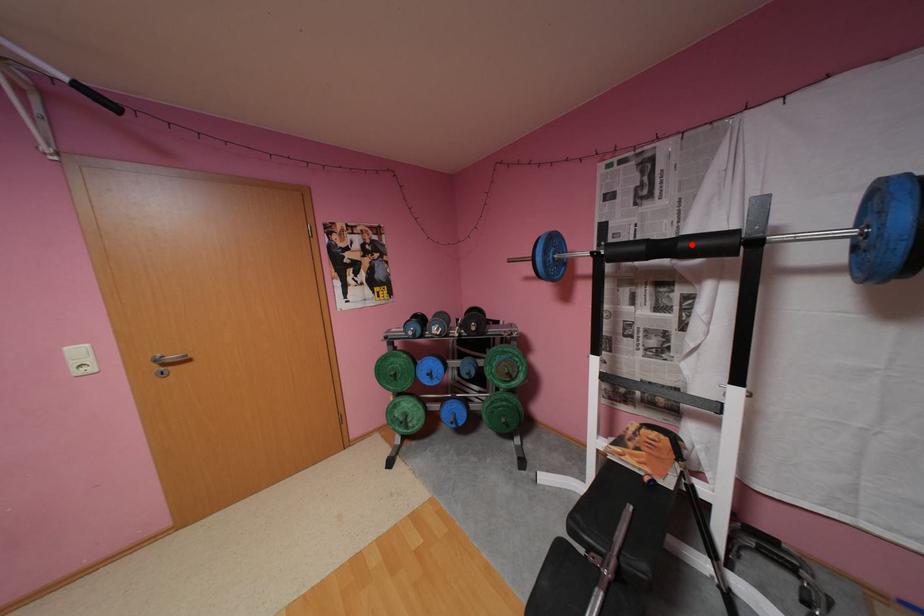
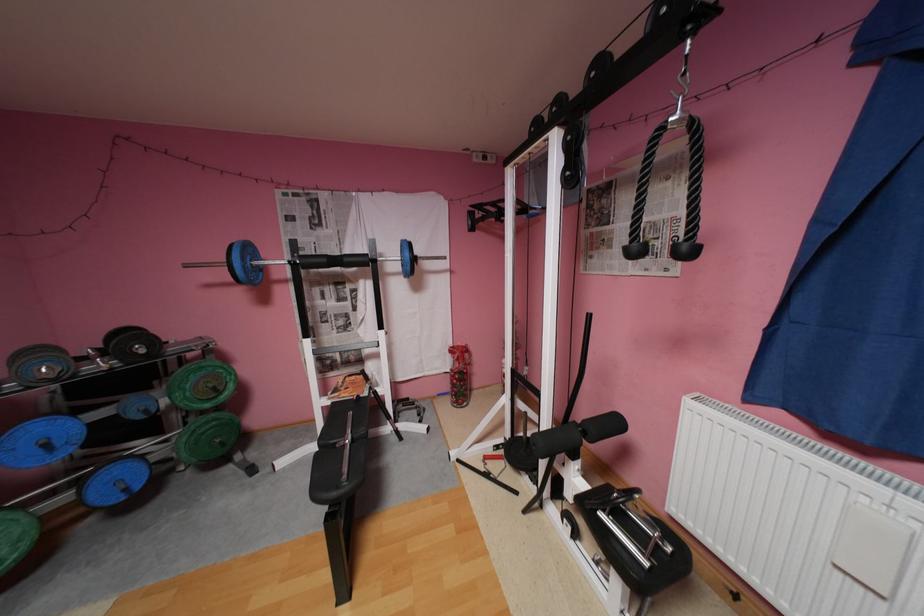
Where in the second image is the point corresponding to the highlighted location from the first image?

(355, 259)